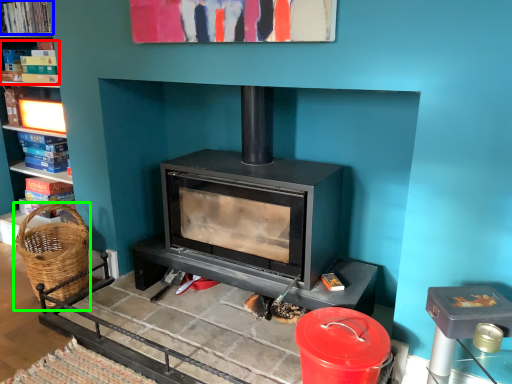
Question: Which object is the closest to the book (highlighted by a red box)? Choose among these: book (highlighted by a blue box) or basket (highlighted by a green box).

Choices:
 (A) book
 (B) basket

Answer: (A)